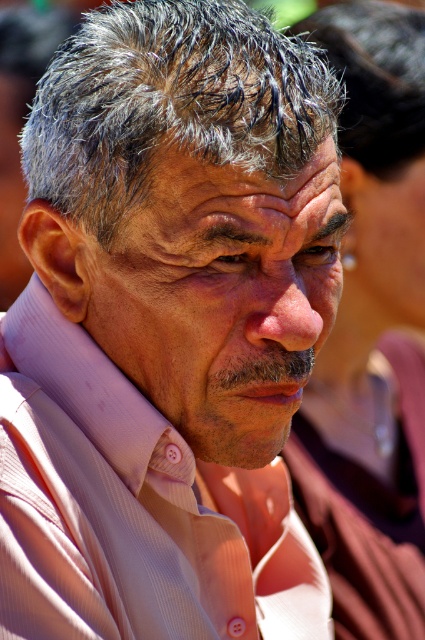
Question: Does gray matte hair at center appear on the left side of dark brown curly hair at upper center?

Choices:
 (A) yes
 (B) no

Answer: (A)

Question: Based on their relative distances, which object is farther from the matte pink shirt at center?

Choices:
 (A) pink striped dress shirt at center
 (B) gray matte hair at center

Answer: (A)

Question: Does pink striped dress shirt at center lie behind gray matte hair at center?

Choices:
 (A) no
 (B) yes

Answer: (A)

Question: Can you confirm if pink striped dress shirt at center is wider than gray matte hair at center?

Choices:
 (A) yes
 (B) no

Answer: (A)

Question: Among these points, which one is nearest to the camera?

Choices:
 (A) (325, 29)
 (B) (176, 42)
 (C) (158, 268)

Answer: (B)

Question: Which of these objects is positioned closest to the dark brown curly hair at upper center?

Choices:
 (A) pink striped dress shirt at center
 (B) gray matte hair at center
 (C) matte pink shirt at center

Answer: (B)